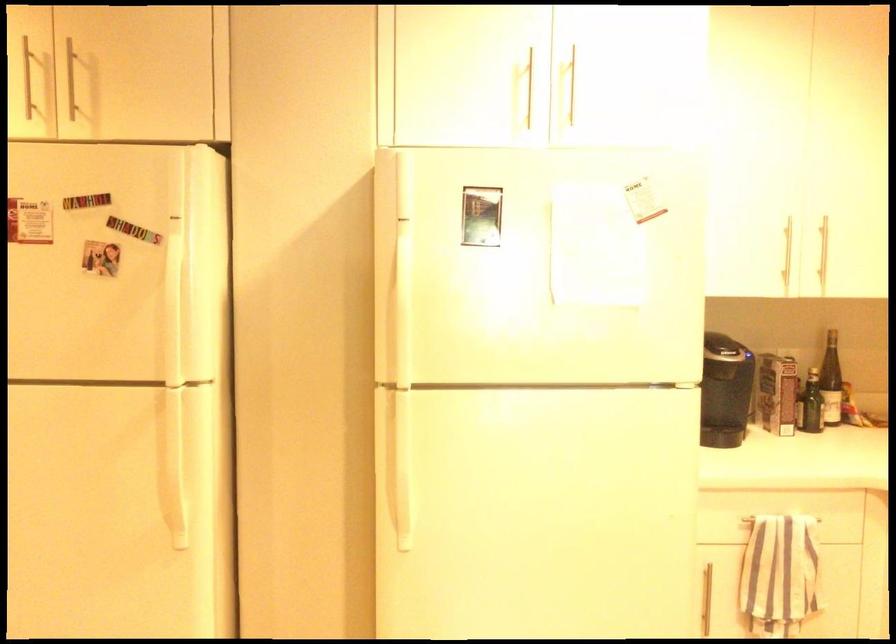
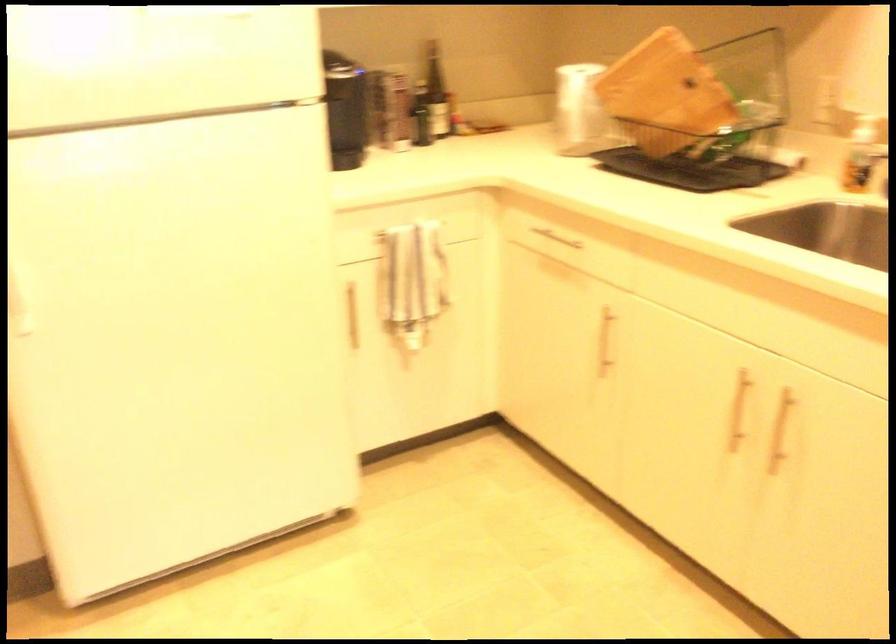
How did the camera likely rotate?

The camera's rotation is toward right-down.